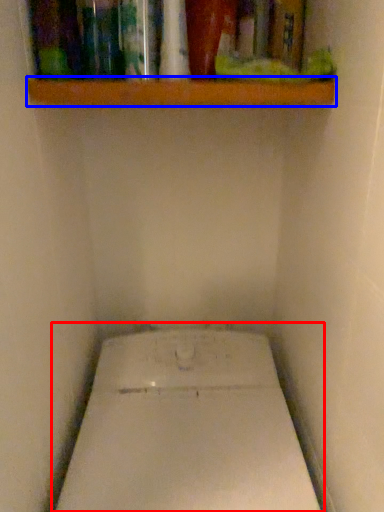
Question: Among these objects, which one is farthest to the camera, toilet (highlighted by a red box) or shelf (highlighted by a blue box)?

Choices:
 (A) toilet
 (B) shelf

Answer: (B)